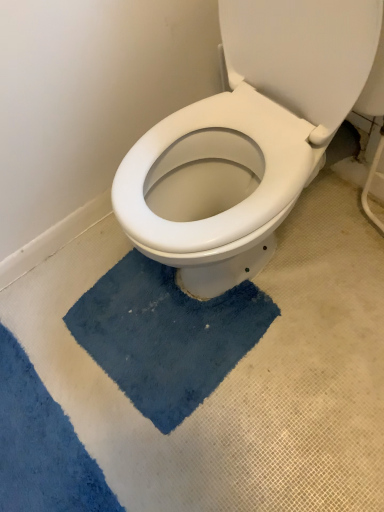
Locate an element on the screen. empty space that is in between blue plush bath mat at lower center, the first bath mat in the left-to-right sequence, and blue plush bath mat at center, acting as the first bath mat starting from the right is located at coordinates (88, 366).